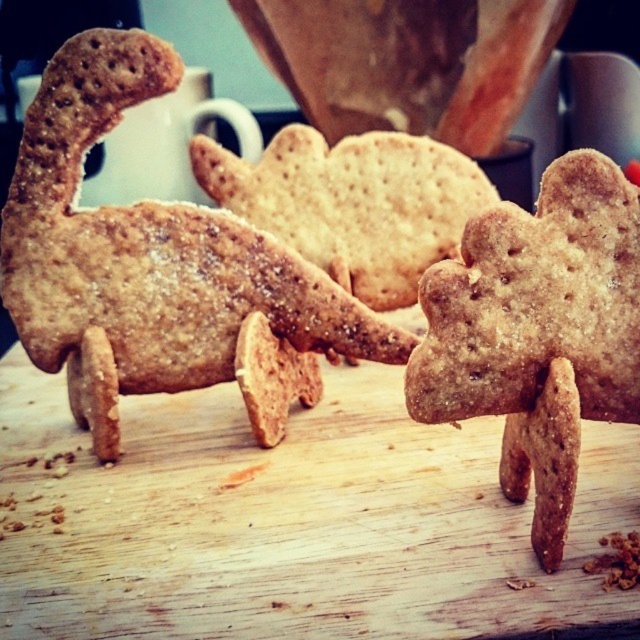
Question: Is golden brown crumbly gingerbread at center positioned at the back of brown crumbly cookie at center?

Choices:
 (A) yes
 (B) no

Answer: (B)

Question: Estimate the real-world distances between objects in this image. Which object is farther from the wooden cutting board at center?

Choices:
 (A) brown crumbly cookie at center
 (B) matte brown cookie at center
 (C) golden brown crumbly gingerbread at center

Answer: (A)

Question: Does wooden cutting board at center appear on the left side of golden brown crumbly gingerbread at center?

Choices:
 (A) no
 (B) yes

Answer: (B)

Question: Which point is farther from the camera taking this photo?

Choices:
 (A) (257, 406)
 (B) (545, 172)
 (C) (476, 481)

Answer: (A)

Question: Which point is farther to the camera?

Choices:
 (A) (566, 240)
 (B) (49, 356)
 (C) (397, 237)
 (D) (336, 419)

Answer: (C)

Question: Does matte brown cookie at center have a lesser width compared to golden brown crumbly gingerbread at center?

Choices:
 (A) no
 (B) yes

Answer: (A)